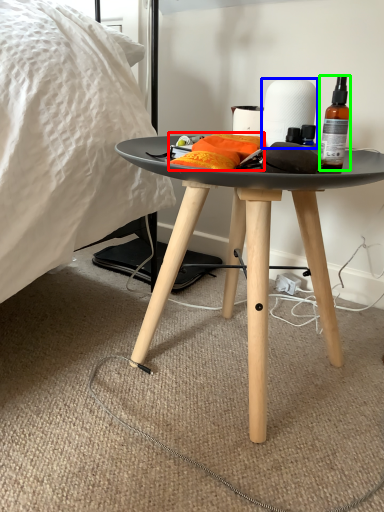
Question: Which object is the farthest from material (highlighted by a red box)? Choose among these: paper towel (highlighted by a blue box) or bottle (highlighted by a green box).

Choices:
 (A) paper towel
 (B) bottle

Answer: (B)